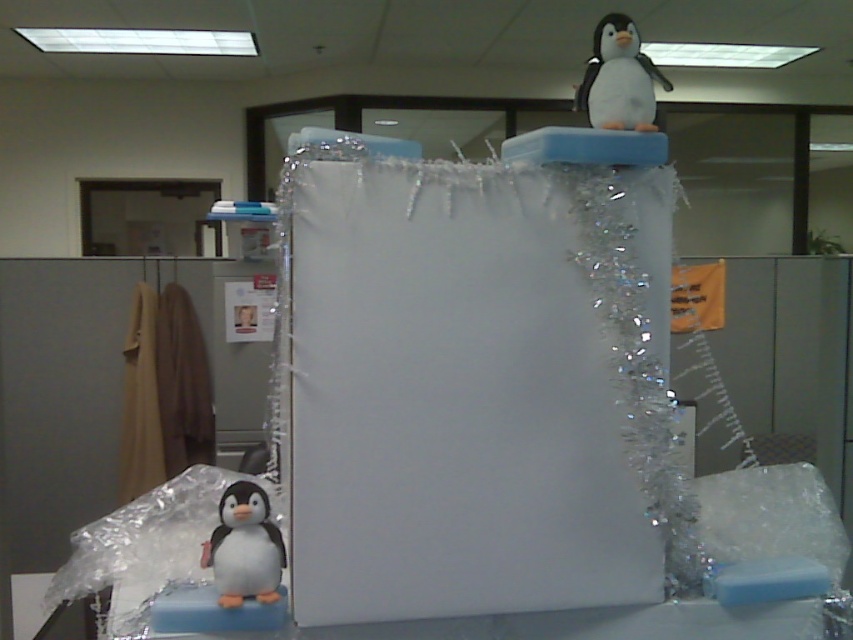
You are organizing a small party in the office and need to place a 12 inch wide cake between the white matte penguin at lower left and the white plush penguin at upper center. Will the cake fit between them?

The distance between the white matte penguin at lower left and the white plush penguin at upper center is 23.84 inches. Since the cake is 12 inches wide, it will fit comfortably between them as there is enough space.

You are an office worker who wants to place a small gift box on the desk in front of the white matte penguin at lower left. The gift box requires 0.2 meters of space. Is there enough space available at the location of point (244, 547)?

The white matte penguin at lower left is located at point (244, 547). The space there is sufficient to accommodate the gift box requiring 0.2 meters of space.